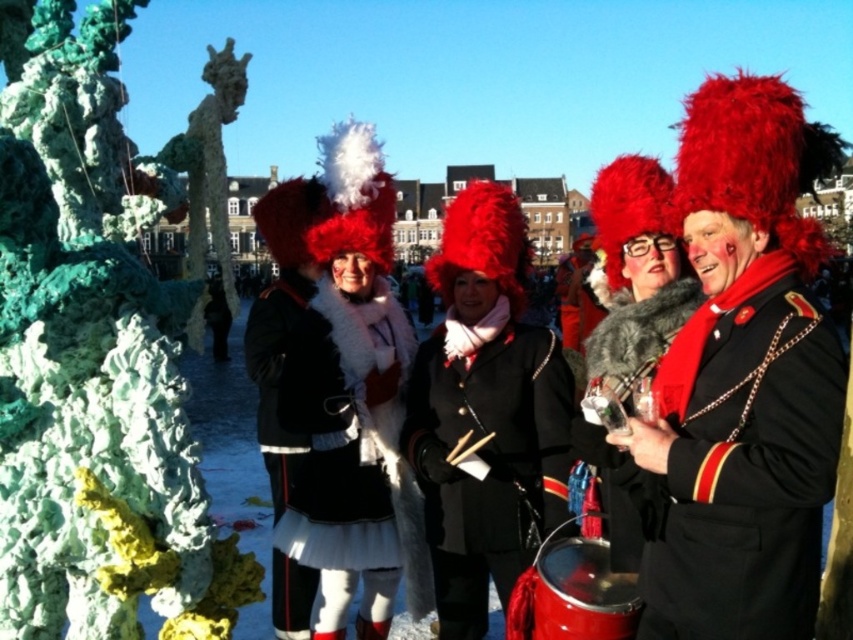
You are organizing a photo shoot and need to place two coats in the center of the scene for a promotional image. The white fur coat at center and the fuzzy fur coat at center are both candidates. Based on their sizes, which coat would require more space horizontally to display properly?

The white fur coat at center is wider than the fuzzy fur coat at center, so it would require more horizontal space to display properly.

You are a photographer standing in front of the sculpture. You want to take a photo that includes both the velvet red hat at center and the shiny red drum at lower center. Which object will appear closer to you in the photo?

The velvet red hat at center will appear closer to you in the photo because it is positioned further to the viewer than the shiny red drum at lower center.